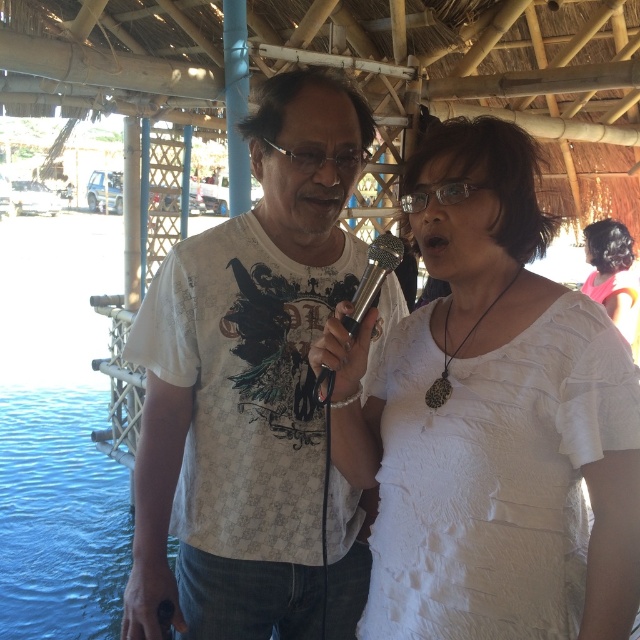
Is blue liquid water at lower left further to camera compared to silver metallic microphone at center?

Yes, it is.

Measure the distance from blue liquid water at lower left to silver metallic microphone at center.

The distance of blue liquid water at lower left from silver metallic microphone at center is 35.58 feet.

Where is `blue liquid water at lower left`? blue liquid water at lower left is located at coordinates click(x=60, y=515).

Between white fabric shirt at center and silver metallic microphone at center, which one appears on the right side from the viewer's perspective?

white fabric shirt at center

This screenshot has width=640, height=640. What do you see at coordinates (496, 420) in the screenshot? I see `white fabric shirt at center` at bounding box center [496, 420].

This screenshot has height=640, width=640. I want to click on white fabric shirt at center, so click(x=496, y=420).

Does white printed t-shirt at center have a greater width compared to blue liquid water at lower left?

No.

Image resolution: width=640 pixels, height=640 pixels. What do you see at coordinates (246, 381) in the screenshot?
I see `white printed t-shirt at center` at bounding box center [246, 381].

Is point (304, 404) positioned before point (12, 496)?

Yes, point (304, 404) is in front of point (12, 496).

Image resolution: width=640 pixels, height=640 pixels. Identify the location of white printed t-shirt at center. 246,381.